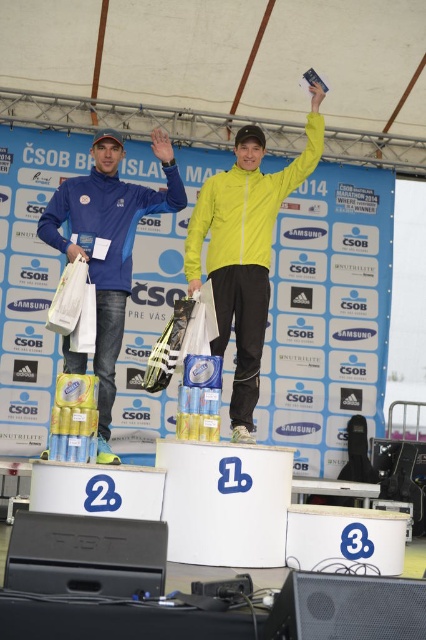
Does yellow matte jacket at center have a lesser width compared to matte blue jacket at left?

Indeed, yellow matte jacket at center has a lesser width compared to matte blue jacket at left.

Between yellow matte jacket at center and matte blue jacket at left, which one has less height?

matte blue jacket at left

Is point (238, 252) farther from camera compared to point (101, 269)?

Yes, point (238, 252) is behind point (101, 269).

What are the coordinates of `yellow matte jacket at center` in the screenshot? It's located at (244, 250).